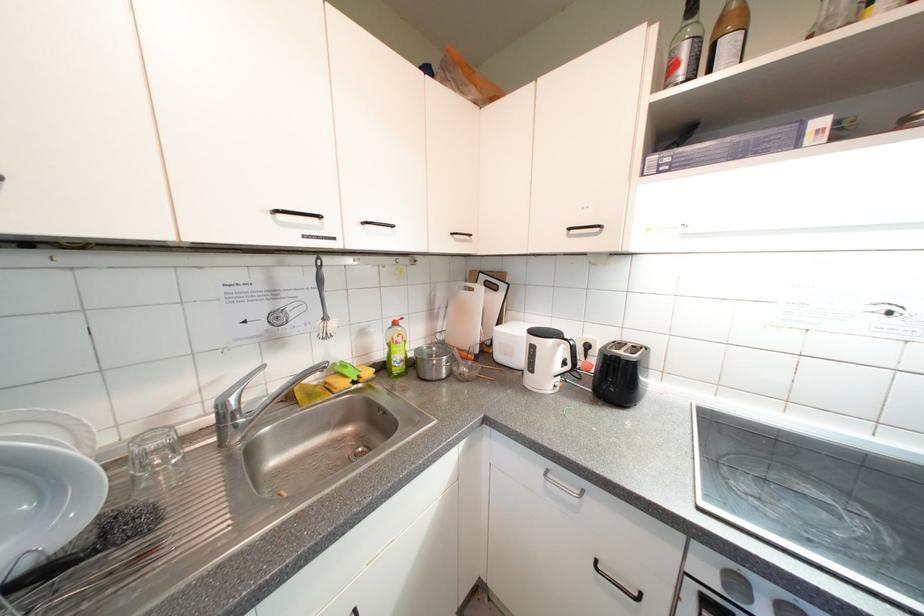
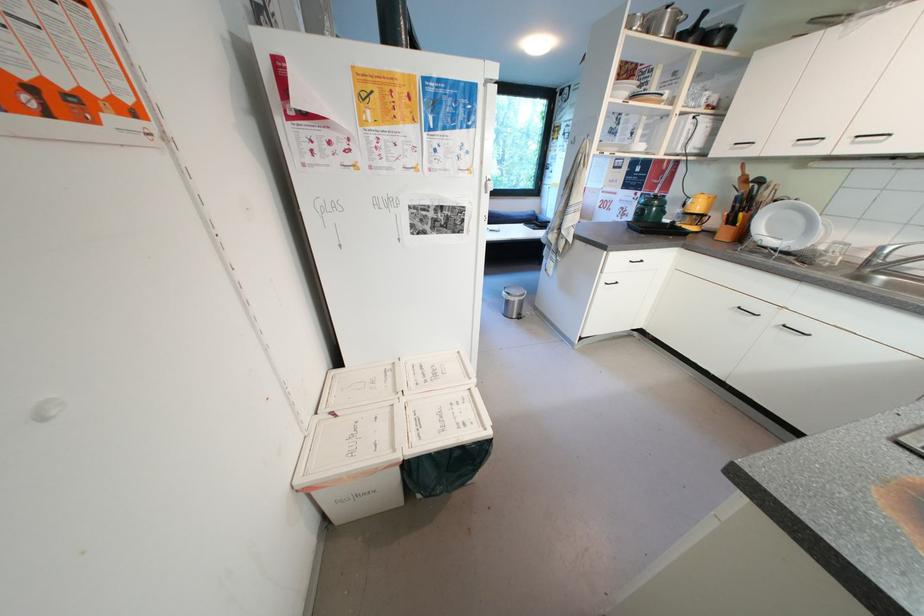
Find the pixel in the second image that matches point 162,447 in the first image.

(845, 249)